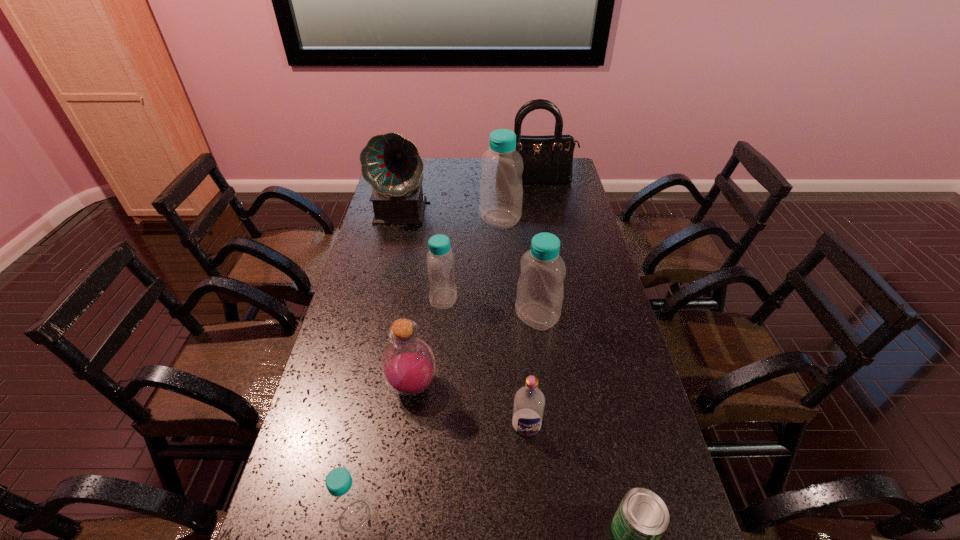
What are the coordinates of `free space that satisfies the following two spatial constraints: 1. on the horn of the record player; 2. on the right side of the third blue bottle from right to left` in the screenshot? It's located at (384, 299).

Where is `free space that satisfies the following two spatial constraints: 1. on the horn of the record player; 2. on the right side of the fourth tallest object`? This screenshot has width=960, height=540. free space that satisfies the following two spatial constraints: 1. on the horn of the record player; 2. on the right side of the fourth tallest object is located at coordinates (380, 316).